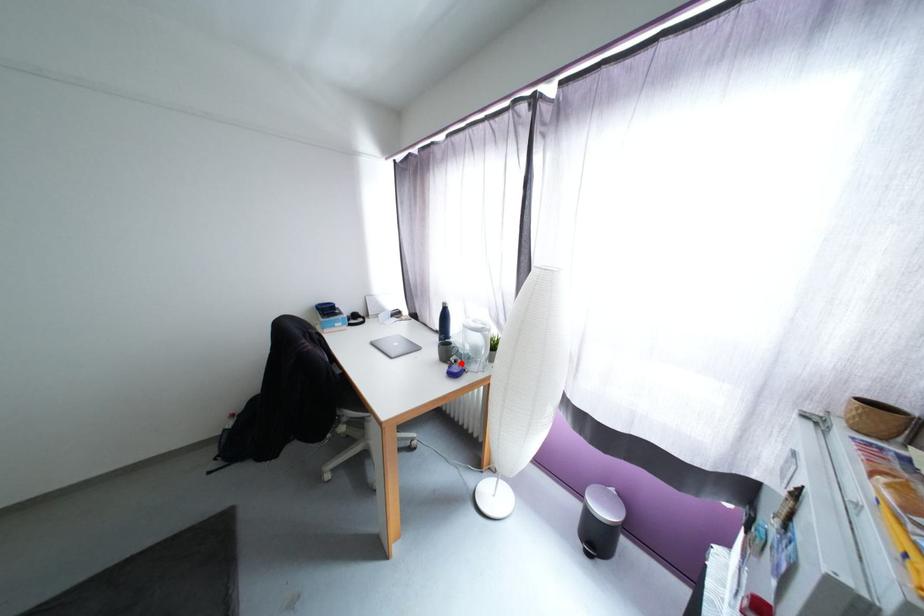
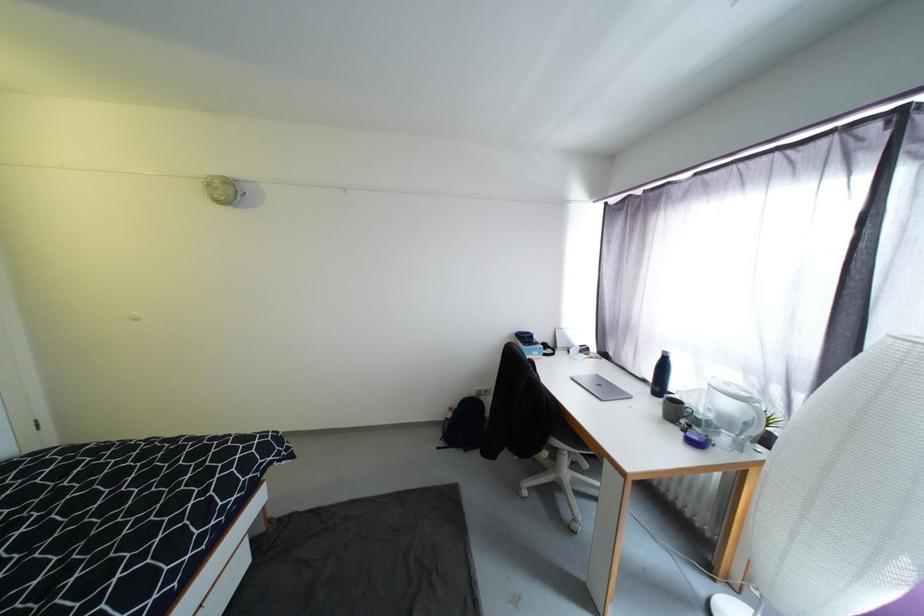
Question: I am providing you with two images of the same scene from different viewpoints. A red point is marked on the first image. At the location where the point appears in image 1, is it still visible in image 2?

Choices:
 (A) Yes
 (B) No

Answer: (A)